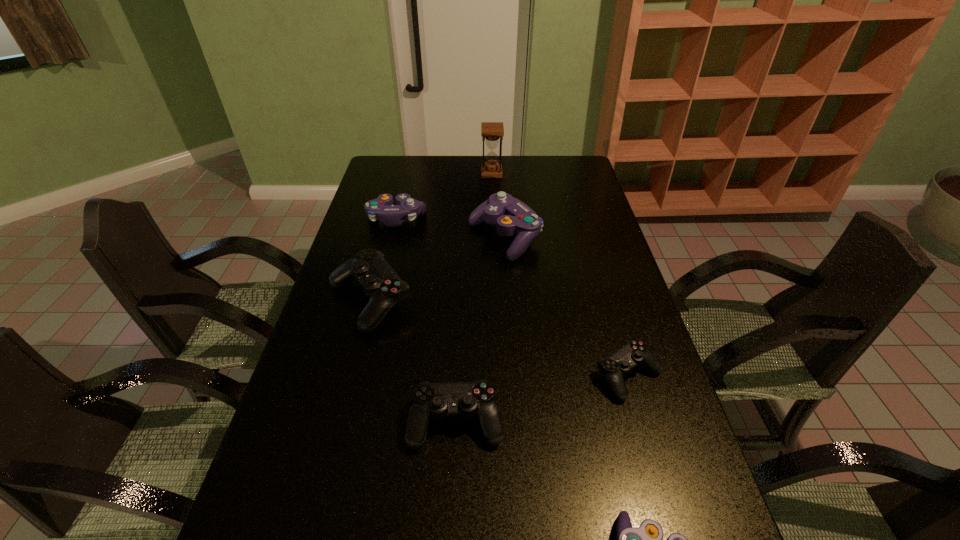
Where is `the farthest object`? Image resolution: width=960 pixels, height=540 pixels. the farthest object is located at coordinates (491, 131).

Find the location of a particular element. The image size is (960, 540). hourglass is located at coordinates (491, 131).

Identify the location of the biggest purple control. (512, 217).

The width and height of the screenshot is (960, 540). What are the coordinates of `the biggest black control` in the screenshot? It's located at (380, 282).

Identify the location of the fourth nearest object. This screenshot has height=540, width=960. (380, 282).

Where is `the leftmost purple control`? the leftmost purple control is located at coordinates (382, 208).

The image size is (960, 540). I want to click on the second black control from left to right, so click(x=477, y=398).

What are the coordinates of `the rightmost black control` in the screenshot? It's located at (633, 353).

Where is `blank area located on the right of the hourglass`? Image resolution: width=960 pixels, height=540 pixels. blank area located on the right of the hourglass is located at coordinates click(573, 173).

Where is `vacant space located 0.070m on the right of the second purple control from left to right`? The width and height of the screenshot is (960, 540). vacant space located 0.070m on the right of the second purple control from left to right is located at coordinates (561, 238).